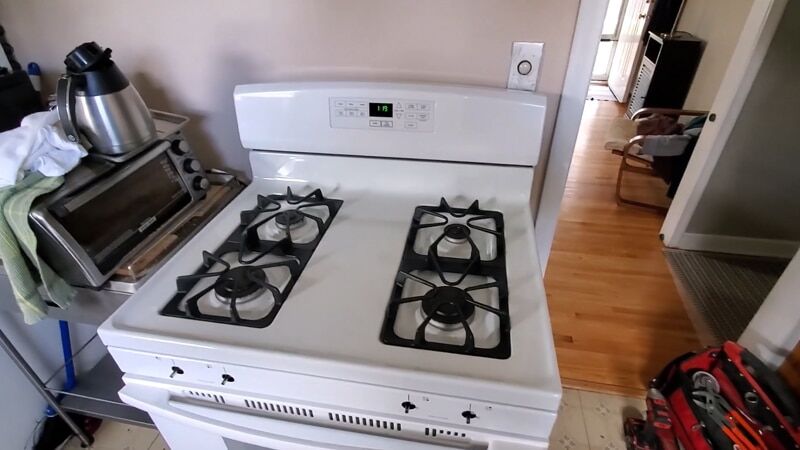
Where is `burner`? The width and height of the screenshot is (800, 450). burner is located at coordinates (257, 283), (290, 211), (464, 238), (470, 311).